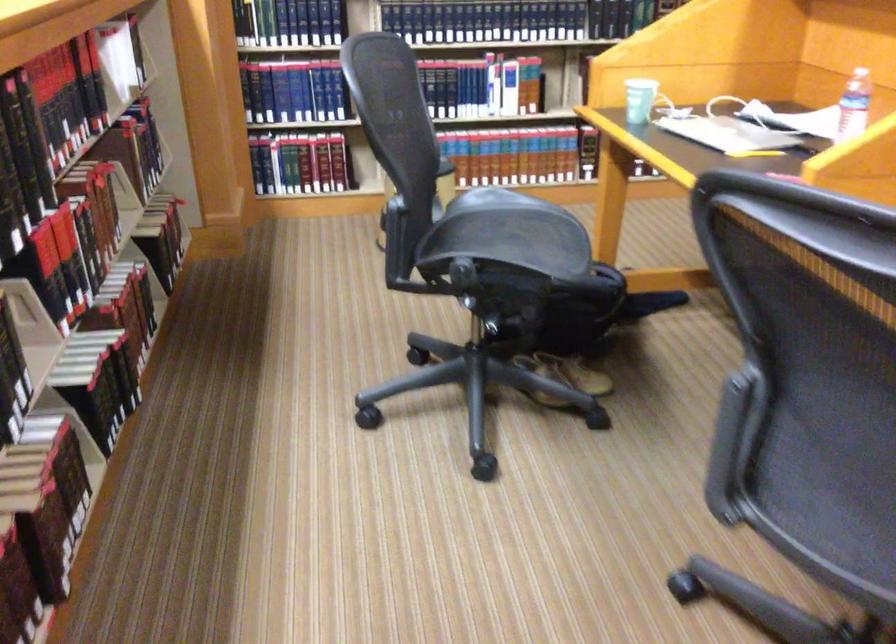
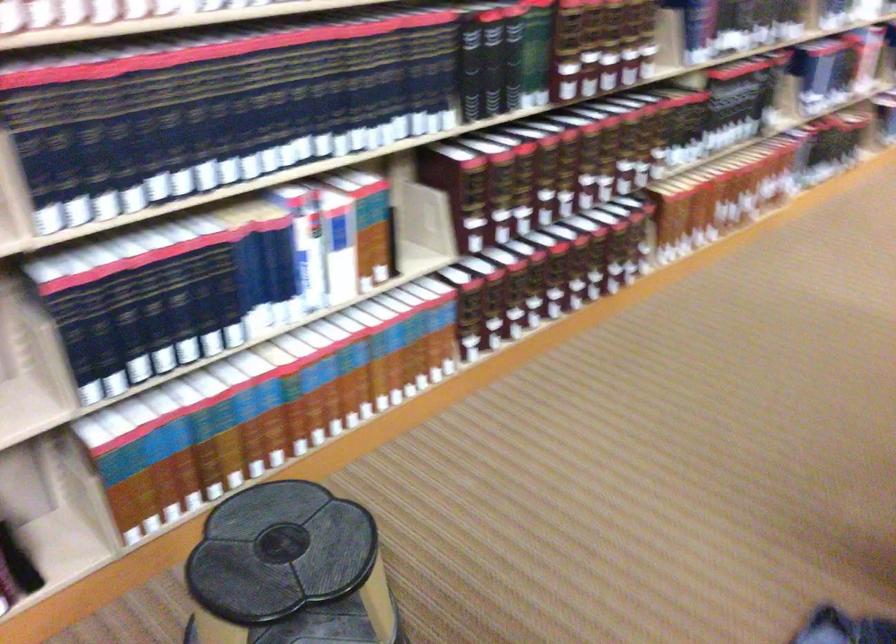
Locate, in the second image, the point that corresponds to (x=576, y=93) in the first image.

(421, 228)